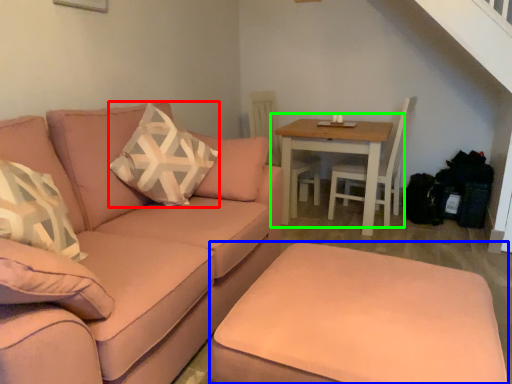
Question: Which object is positioned closest to throw pillow (highlighted by a red box)? Select from footrest (highlighted by a blue box) and table (highlighted by a green box).

Choices:
 (A) footrest
 (B) table

Answer: (A)